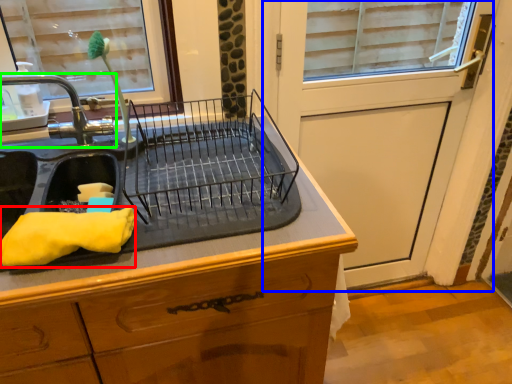
Question: Which is farther away from material (highlighted by a red box)? screen door (highlighted by a blue box) or tap (highlighted by a green box)?

Choices:
 (A) screen door
 (B) tap

Answer: (A)